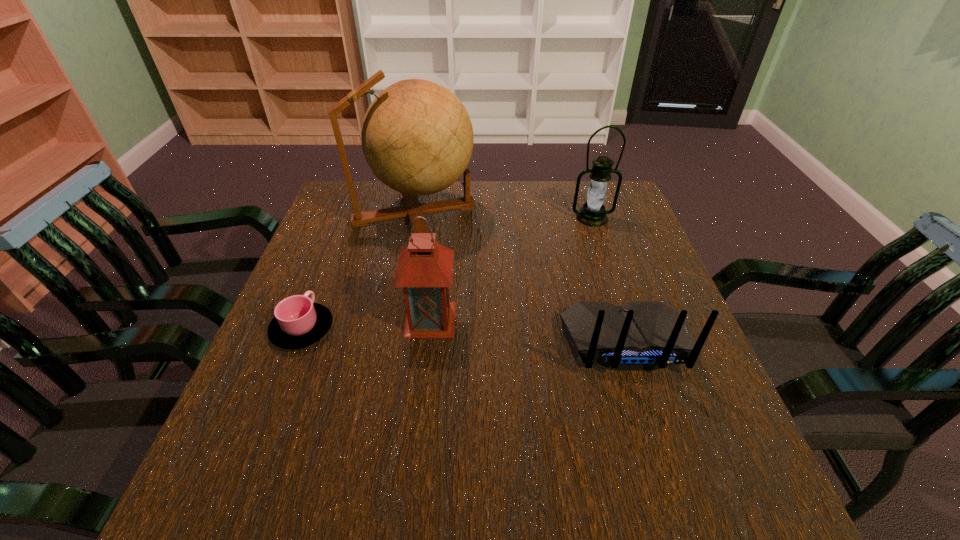
Identify the location of the tallest object. The height and width of the screenshot is (540, 960). (417, 137).

You are a GUI agent. You are given a task and a screenshot of the screen. Output one action in this format:
    pyautogui.click(x=<x>, y=<y>)
    Task: Click on the farther lantern
    
    Given the screenshot: What is the action you would take?
    pyautogui.click(x=592, y=213)

Find the location of a particular element. The height and width of the screenshot is (540, 960). the left lantern is located at coordinates (425, 268).

Where is `router`? Image resolution: width=960 pixels, height=540 pixels. router is located at coordinates (637, 336).

Locate an element on the screen. The image size is (960, 540). cup is located at coordinates (299, 322).

The width and height of the screenshot is (960, 540). Find the location of `vacant space located on the surface of the tallest object`. vacant space located on the surface of the tallest object is located at coordinates click(x=535, y=214).

Locate an element on the screen. free point located on the side where the right lantern emits light is located at coordinates (607, 264).

This screenshot has height=540, width=960. Find the location of `blank space located on the front of the left lantern`. blank space located on the front of the left lantern is located at coordinates (425, 365).

Find the location of a particular element. The height and width of the screenshot is (540, 960). vacant space located on the back of the second shortest object is located at coordinates (670, 485).

In order to click on free space located 0.340m on the side with the handle of the shortest object in this screenshot , I will do `click(345, 222)`.